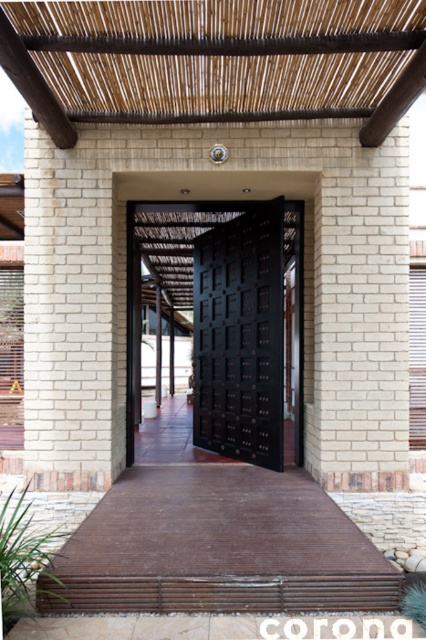
You are standing at the entrance of the building and want to take a photo. There are two points marked in the image, point 1 at coordinates point (95, 317) and point 2 at coordinates point (210, 273). Which point will appear larger in your photo?

Point 1 at coordinates point (95, 317) is closer to the camera than point 2 at coordinates point (210, 273). Since objects closer to the camera appear larger in a photo, point 1 will appear larger in the photo.

You are a painter standing at the entrance of the building. You need to paint the white brick pillar at center and the black matte door at center. Which object requires a longer ladder to reach its top?

The white brick pillar at center requires a longer ladder because it is much taller than the black matte door at center.